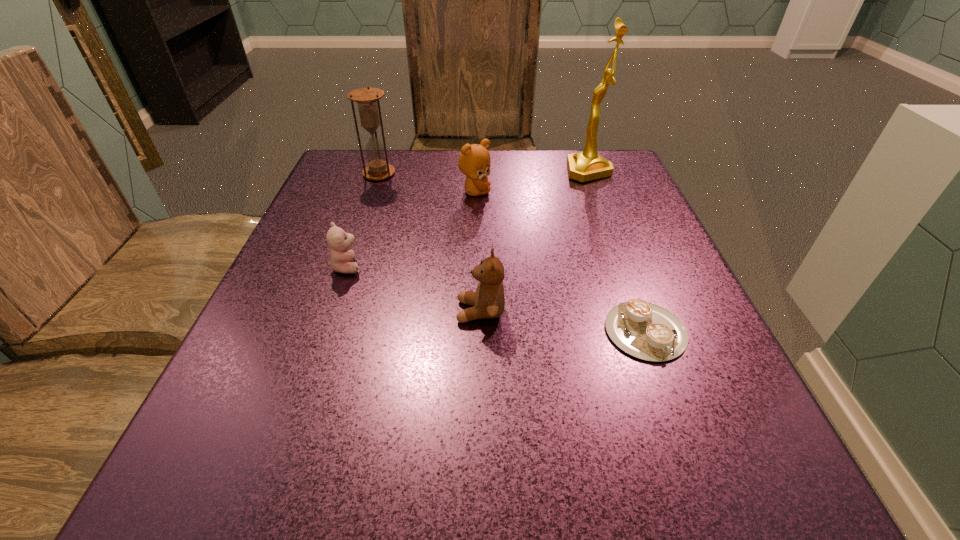
Where is `vacant area situated 0.080m on the right of the hourglass`? The width and height of the screenshot is (960, 540). vacant area situated 0.080m on the right of the hourglass is located at coordinates (430, 174).

The image size is (960, 540). What are the coordinates of `vacant space situated on the face of the third farthest object` in the screenshot? It's located at (541, 192).

You are a GUI agent. You are given a task and a screenshot of the screen. Output one action in this format:
    pyautogui.click(x=<x>, y=<y>)
    Task: Click on the vacant space located 0.310m on the front-facing side of the nearest teddy bear
    The width and height of the screenshot is (960, 540).
    Given the screenshot: What is the action you would take?
    (261, 311)

Where is `vacant space situated on the front-facing side of the nearest teddy bear`? This screenshot has height=540, width=960. vacant space situated on the front-facing side of the nearest teddy bear is located at coordinates (300, 311).

Image resolution: width=960 pixels, height=540 pixels. In order to click on free location located on the front-facing side of the nearest teddy bear in this screenshot , I will do `click(255, 311)`.

At what (x,y) coordinates should I click in order to perform the action: click on vacant space located at the face of the fourth farthest object. Please return your answer as a coordinate pair (x, y). This screenshot has height=540, width=960. Looking at the image, I should click on (515, 266).

The width and height of the screenshot is (960, 540). I want to click on free space located on the back of the cappuccino, so click(x=612, y=239).

What are the coordinates of `award located in the far edge section of the desktop` in the screenshot? It's located at (588, 165).

The height and width of the screenshot is (540, 960). In order to click on hourglass that is at the far edge in this screenshot , I will do `click(367, 99)`.

You are a GUI agent. You are given a task and a screenshot of the screen. Output one action in this format:
    pyautogui.click(x=<x>, y=<y>)
    Task: Click on the teddy bear situated at the far edge
    This screenshot has height=540, width=960.
    Given the screenshot: What is the action you would take?
    pyautogui.click(x=474, y=162)